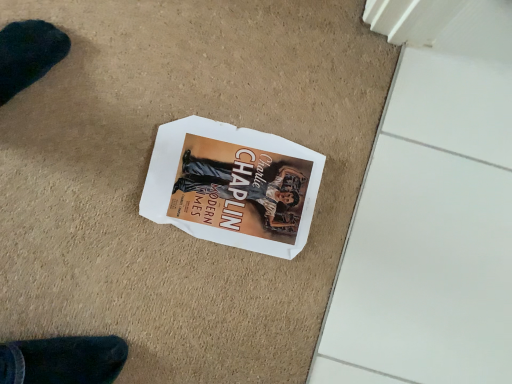
Locate an element on the screen. blank space above white paper at center (from a real-world perspective) is located at coordinates (234, 188).